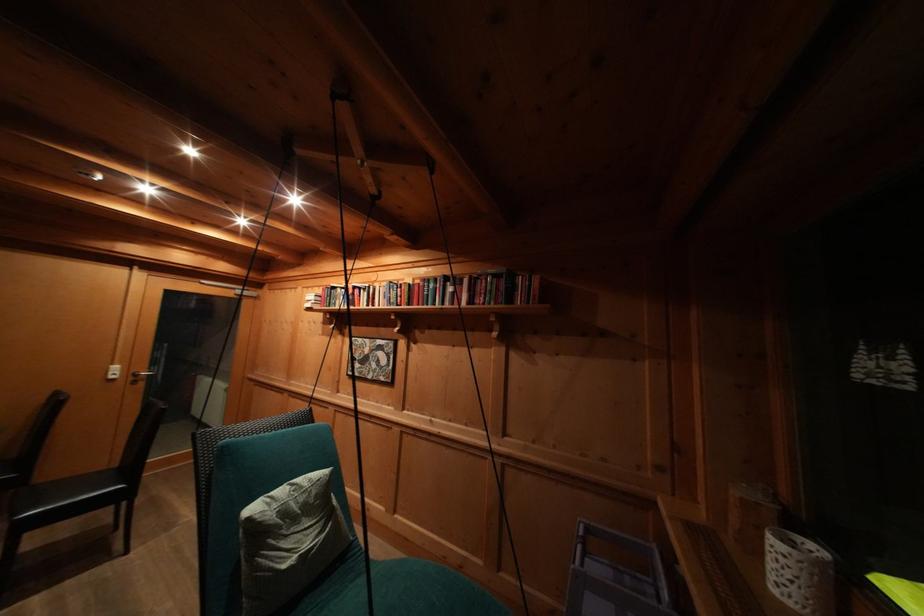
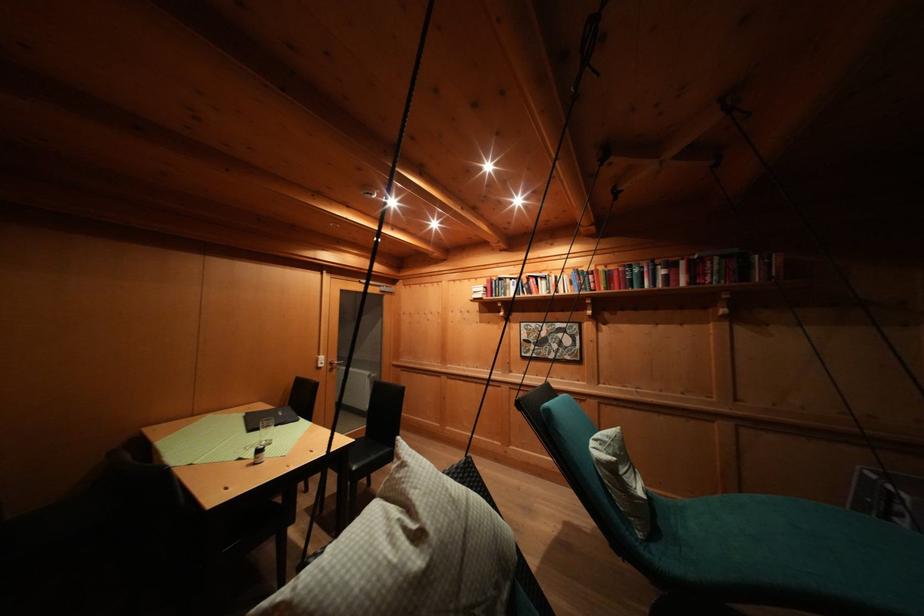
Find the pixel in the second image that matches point (122, 371) in the first image.

(327, 362)